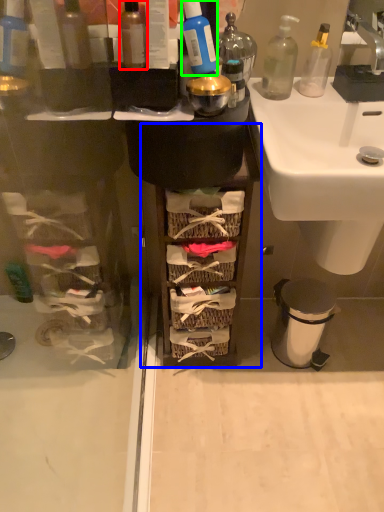
Question: Which is nearer to the bottle (highlighted by a red box)? cabinetry (highlighted by a blue box) or cleaning product (highlighted by a green box).

Choices:
 (A) cabinetry
 (B) cleaning product

Answer: (B)